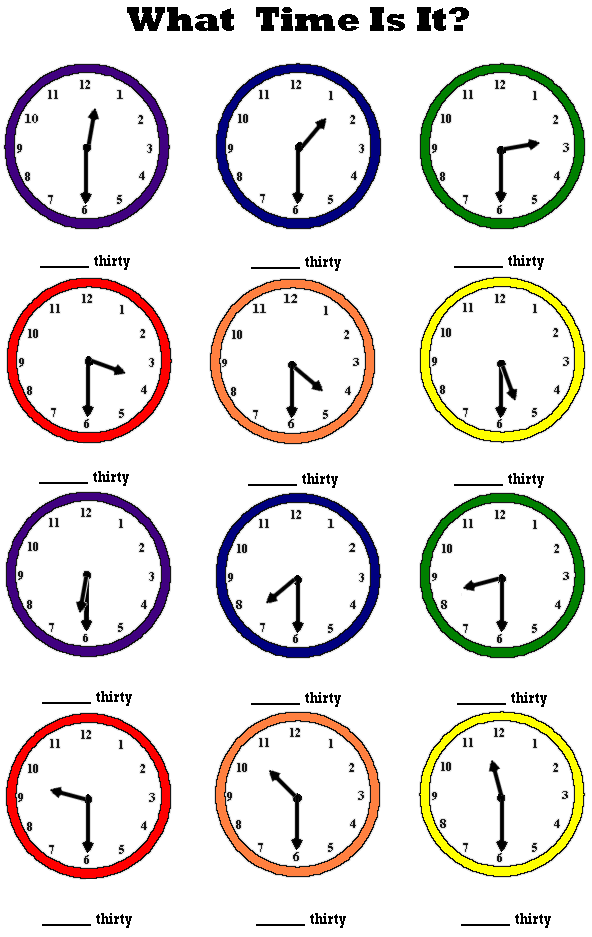
Where is `green clock`? Image resolution: width=592 pixels, height=937 pixels. green clock is located at coordinates (498, 110), (521, 560).